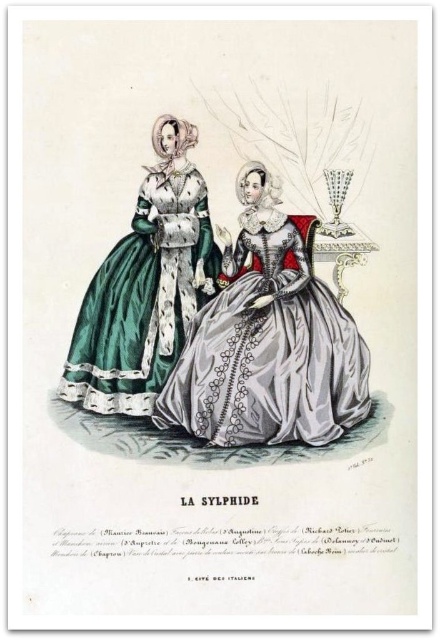
Question: Can you confirm if silvery satin gown at center is positioned to the left of green satin dress at left?

Choices:
 (A) yes
 (B) no

Answer: (B)

Question: Is silvery satin gown at center behind green satin dress at left?

Choices:
 (A) no
 (B) yes

Answer: (A)

Question: Does silvery satin gown at center have a smaller size compared to green satin dress at left?

Choices:
 (A) yes
 (B) no

Answer: (B)

Question: Which object is closer to the camera taking this photo?

Choices:
 (A) silvery satin gown at center
 (B) green satin dress at left

Answer: (A)